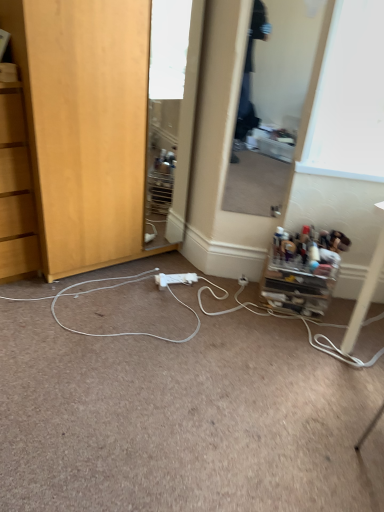
Question: Is point (153, 233) positioned closer to the camera than point (142, 96)?

Choices:
 (A) closer
 (B) farther

Answer: (B)

Question: In terms of size, does clear glass mirror at center, which is counted as the 2th mirror, starting from the right, appear bigger or smaller than wooden cabinet at lower left, which appears as the first cabinetry when viewed from the top?

Choices:
 (A) small
 (B) big

Answer: (A)

Question: Estimate the real-world distances between objects in this image. Which object is farther from the white plastic power outlet at center?

Choices:
 (A) white plastic electric outlet at center
 (B) wooden cabinet at lower left, placed as the 2th cabinetry when sorted from right to left
 (C) clear plastic organizer at lower right, marked as the first cabinetry in a bottom-to-top arrangement
 (D) white plastic power strip at center
 (E) clear glass mirror at center, which is the 2th mirror from left to right

Answer: (E)

Question: Considering the real-world distances, which object is farthest from the clear glass mirror at center, which is counted as the 2th mirror, starting from the right?

Choices:
 (A) white plastic power strip at center
 (B) white plastic electric outlet at center
 (C) clear plastic organizer at lower right, which is the second cabinetry in left-to-right order
 (D) wooden cabinet at lower left, the 1th cabinetry in the left-to-right sequence
 (E) clear glass mirror at center, arranged as the 1th mirror when viewed from the right

Answer: (B)